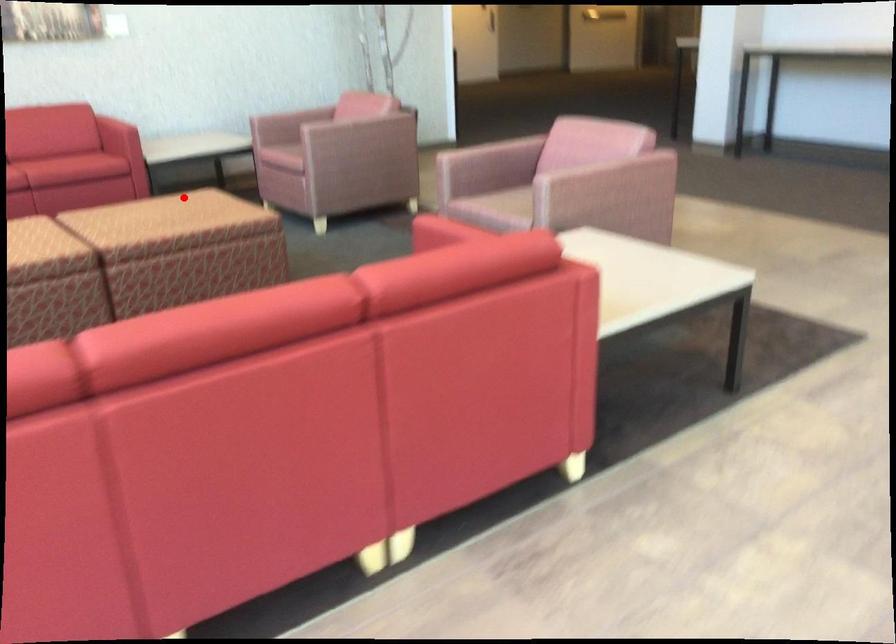
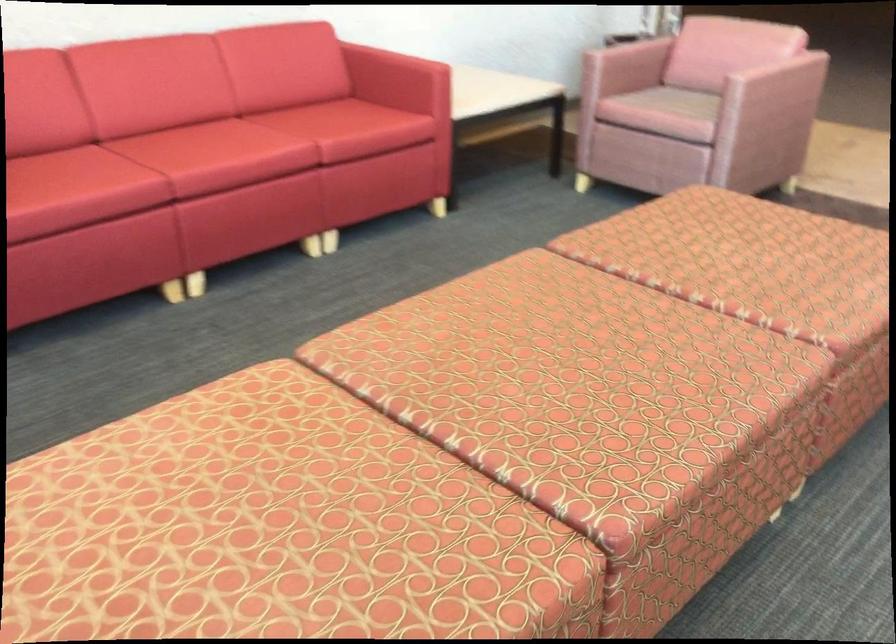
In the second image, find the point that corresponds to the highlighted location in the first image.

(762, 245)